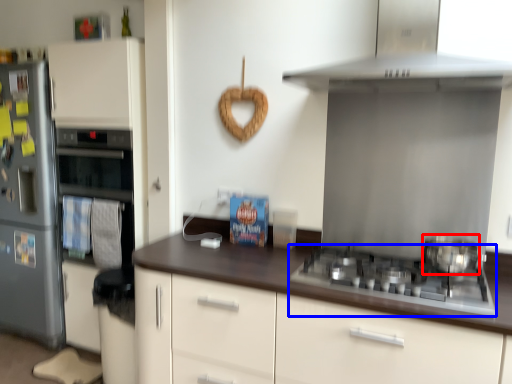
Question: Which of the following is the closest to the observer, kitchen appliance (highlighted by a red box) or gas stove (highlighted by a blue box)?

Choices:
 (A) kitchen appliance
 (B) gas stove

Answer: (B)